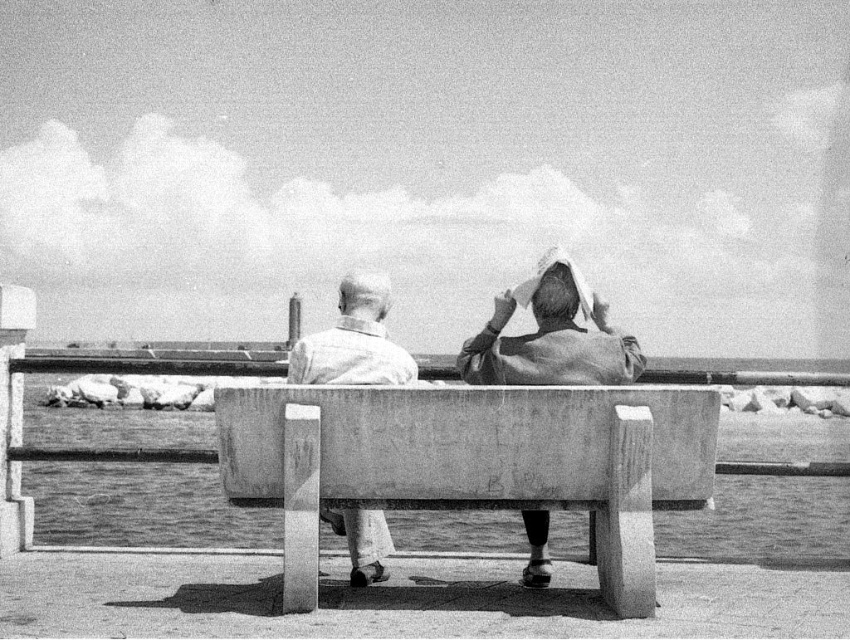
Question: Estimate the real-world distances between objects in this image. Which object is closer to the smooth leather jacket at center?

Choices:
 (A) smooth concrete bench at center
 (B) smooth white shirt at center

Answer: (B)

Question: Does smooth concrete bench at center have a greater width compared to smooth leather jacket at center?

Choices:
 (A) yes
 (B) no

Answer: (A)

Question: Which of the following is the closest to the observer?

Choices:
 (A) (370, 358)
 (B) (364, 515)
 (C) (268, 394)

Answer: (C)

Question: Can you confirm if smooth leather jacket at center is positioned to the right of smooth white shirt at center?

Choices:
 (A) no
 (B) yes

Answer: (B)

Question: Does smooth concrete bench at center have a greater width compared to smooth leather jacket at center?

Choices:
 (A) no
 (B) yes

Answer: (B)

Question: Which point is closer to the camera taking this photo?

Choices:
 (A) (355, 339)
 (B) (361, 275)
 (C) (273, 444)

Answer: (C)